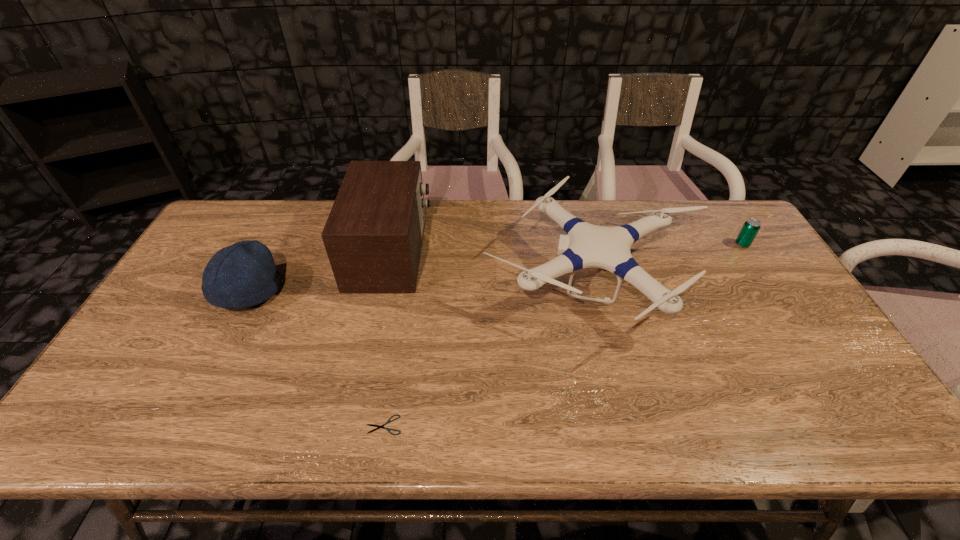
Locate an element on the screen. the tallest object is located at coordinates (373, 236).

Where is `drone`? The width and height of the screenshot is (960, 540). drone is located at coordinates (586, 245).

At what (x,y) coordinates should I click in order to perform the action: click on the third tallest object. Please return your answer as a coordinate pair (x, y). The image size is (960, 540). Looking at the image, I should click on (244, 274).

Identify the location of the leftmost object. (244, 274).

The image size is (960, 540). I want to click on beer can, so click(x=751, y=227).

This screenshot has height=540, width=960. I want to click on the rightmost object, so click(x=751, y=227).

Identify the location of the shortest object. Image resolution: width=960 pixels, height=540 pixels. (378, 426).

I want to click on shears, so click(x=378, y=426).

Identify the location of blank area located 0.300m on the front-facing side of the tallest object. 523,252.

The image size is (960, 540). Identify the location of vacant space located on the back of the second object from right to left. (574, 205).